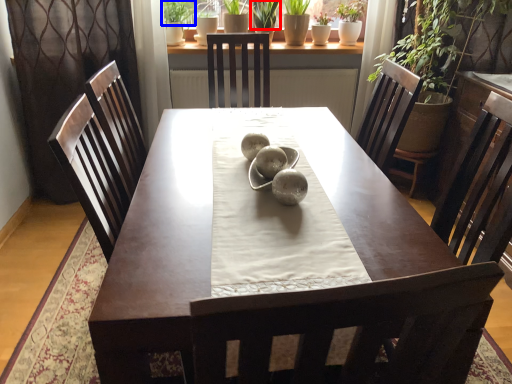
Question: Which object is further to the camera taking this photo, plant (highlighted by a red box) or plant (highlighted by a blue box)?

Choices:
 (A) plant
 (B) plant

Answer: (A)